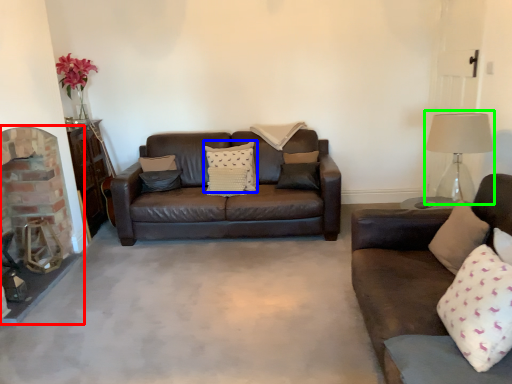
Question: Estimate the real-world distances between objects in this image. Which object is closer to fireplace (highlighted by a red box), pillow (highlighted by a blue box) or table lamp (highlighted by a green box)?

Choices:
 (A) pillow
 (B) table lamp

Answer: (A)